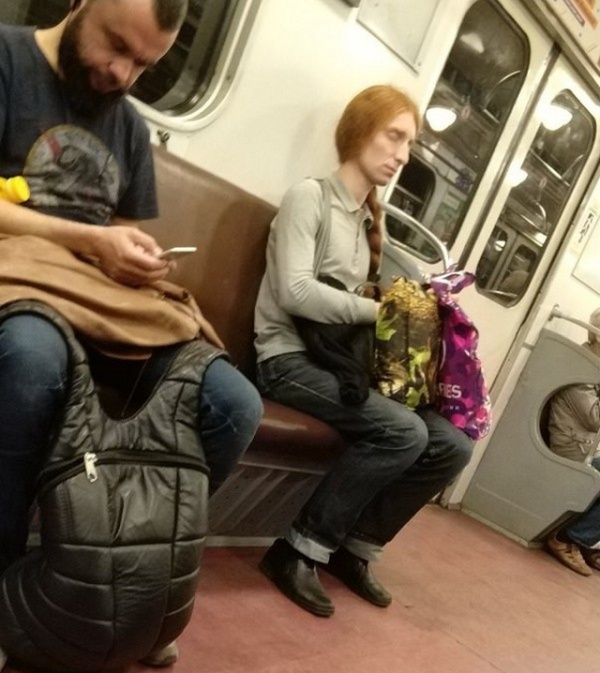
Image resolution: width=600 pixels, height=673 pixels. I want to click on redish floor, so click(x=433, y=647).